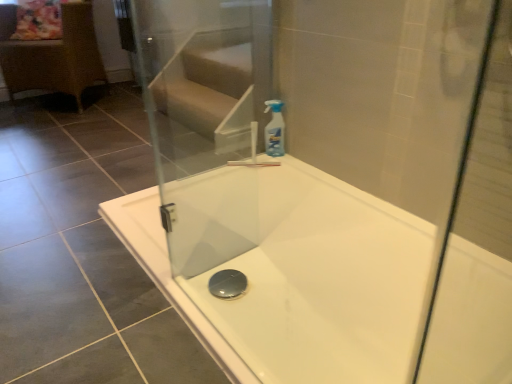
Question: Does rattan wicker chair at left turn towards transparent plastic spray bottle at upper right?

Choices:
 (A) yes
 (B) no

Answer: (B)

Question: Is rattan wicker chair at left not near transparent plastic spray bottle at upper right?

Choices:
 (A) yes
 (B) no

Answer: (A)

Question: Considering the relative positions of rattan wicker chair at left and transparent plastic spray bottle at upper right in the image provided, is rattan wicker chair at left behind transparent plastic spray bottle at upper right?

Choices:
 (A) no
 (B) yes

Answer: (B)

Question: Is rattan wicker chair at left smaller than transparent plastic spray bottle at upper right?

Choices:
 (A) no
 (B) yes

Answer: (A)

Question: Can you confirm if rattan wicker chair at left is thinner than transparent plastic spray bottle at upper right?

Choices:
 (A) no
 (B) yes

Answer: (A)

Question: From the image's perspective, does rattan wicker chair at left appear lower than transparent plastic spray bottle at upper right?

Choices:
 (A) yes
 (B) no

Answer: (B)

Question: Is the position of transparent glass screen door at upper center less distant than that of white glossy bathtub at center?

Choices:
 (A) yes
 (B) no

Answer: (B)

Question: Is transparent glass screen door at upper center located outside white glossy bathtub at center?

Choices:
 (A) yes
 (B) no

Answer: (A)

Question: Can you confirm if transparent glass screen door at upper center is positioned to the right of white glossy bathtub at center?

Choices:
 (A) yes
 (B) no

Answer: (B)

Question: Considering the relative sizes of transparent glass screen door at upper center and white glossy bathtub at center in the image provided, is transparent glass screen door at upper center thinner than white glossy bathtub at center?

Choices:
 (A) no
 (B) yes

Answer: (B)

Question: Is transparent glass screen door at upper center positioned with its back to white glossy bathtub at center?

Choices:
 (A) no
 (B) yes

Answer: (A)

Question: Is transparent glass screen door at upper center oriented towards white glossy bathtub at center?

Choices:
 (A) no
 (B) yes

Answer: (B)

Question: Would you say rattan wicker chair at left is part of white glossy bathtub at center's contents?

Choices:
 (A) yes
 (B) no

Answer: (B)